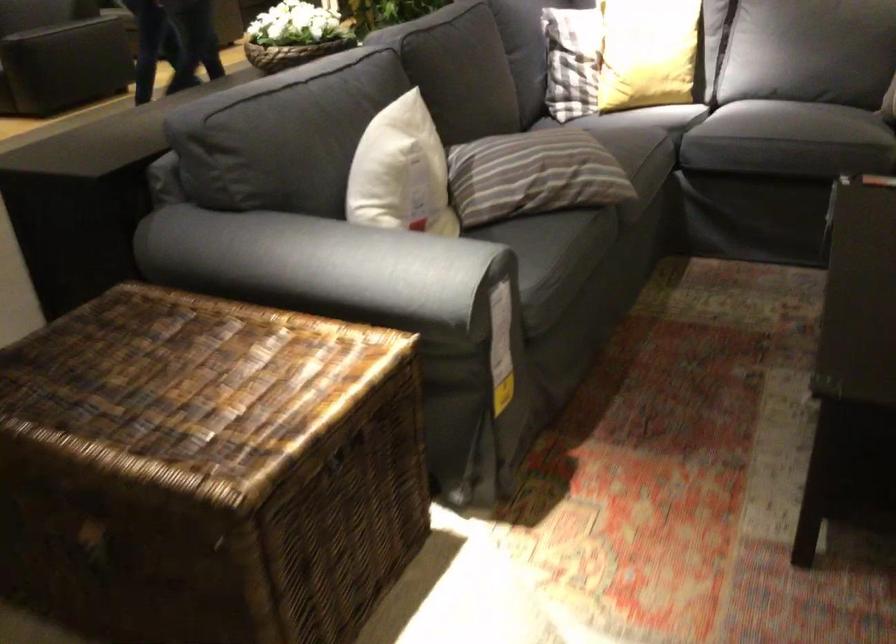
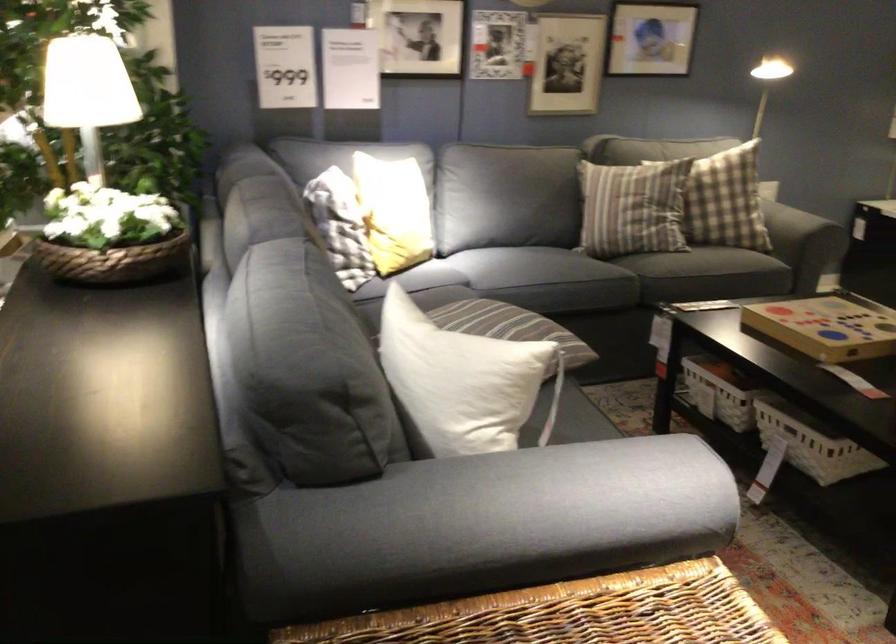
Where in the second image is the point corresponding to point (367, 185) from the first image?

(462, 381)